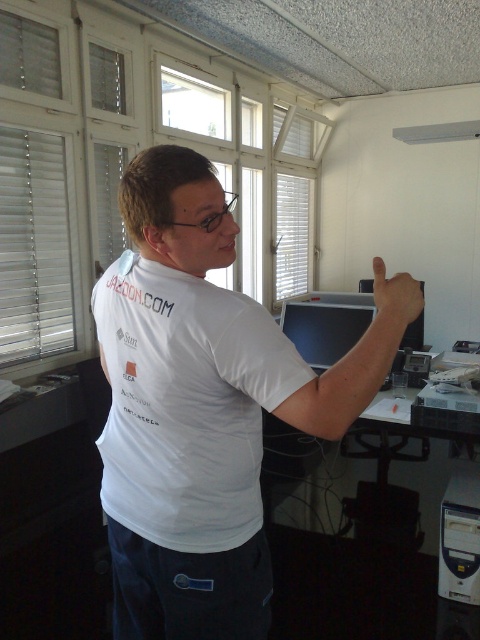
Question: Which object is closer to the camera taking this photo?

Choices:
 (A) matte white hand at upper right
 (B) white matte t-shirt at upper center

Answer: (B)

Question: Which object appears farthest from the camera in this image?

Choices:
 (A) white matte t-shirt at upper center
 (B) matte white hand at upper right

Answer: (B)

Question: Among these objects, which one is farthest from the camera?

Choices:
 (A) white matte t-shirt at upper center
 (B) white matte shirt at center
 (C) matte white hand at upper right

Answer: (C)

Question: Is white matte t-shirt at upper center positioned in front of matte white hand at upper right?

Choices:
 (A) yes
 (B) no

Answer: (A)

Question: Does white matte shirt at center have a lesser width compared to white matte t-shirt at upper center?

Choices:
 (A) no
 (B) yes

Answer: (A)

Question: Does white matte t-shirt at upper center appear under matte white hand at upper right?

Choices:
 (A) yes
 (B) no

Answer: (A)